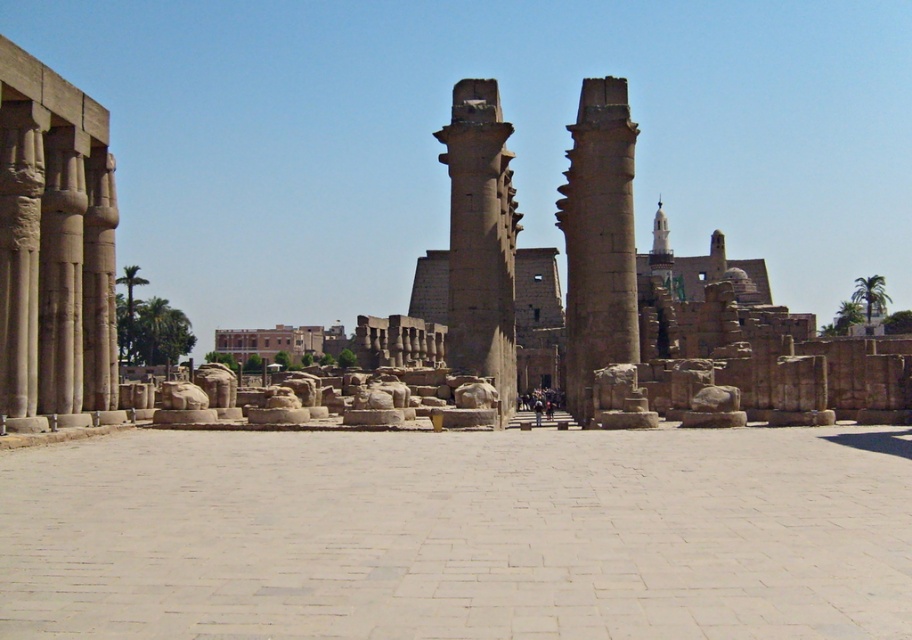
Question: Which point appears closest to the camera in this image?

Choices:
 (A) (719, 452)
 (B) (506, 323)

Answer: (A)

Question: Is smooth stone columns at left wider than smooth stone column at center?

Choices:
 (A) no
 (B) yes

Answer: (A)

Question: Does light beige stone plaza at center appear under smooth sandstone column at center?

Choices:
 (A) yes
 (B) no

Answer: (A)

Question: Which of these objects is positioned closest to the smooth stone columns at left?

Choices:
 (A) smooth stone column at center
 (B) light beige stone plaza at center

Answer: (B)

Question: Is light beige stone plaza at center bigger than smooth stone column at center?

Choices:
 (A) yes
 (B) no

Answer: (B)

Question: Which point appears farthest from the camera in this image?

Choices:
 (A) (690, 515)
 (B) (609, 205)
 (C) (477, 180)
 (D) (50, 408)

Answer: (C)